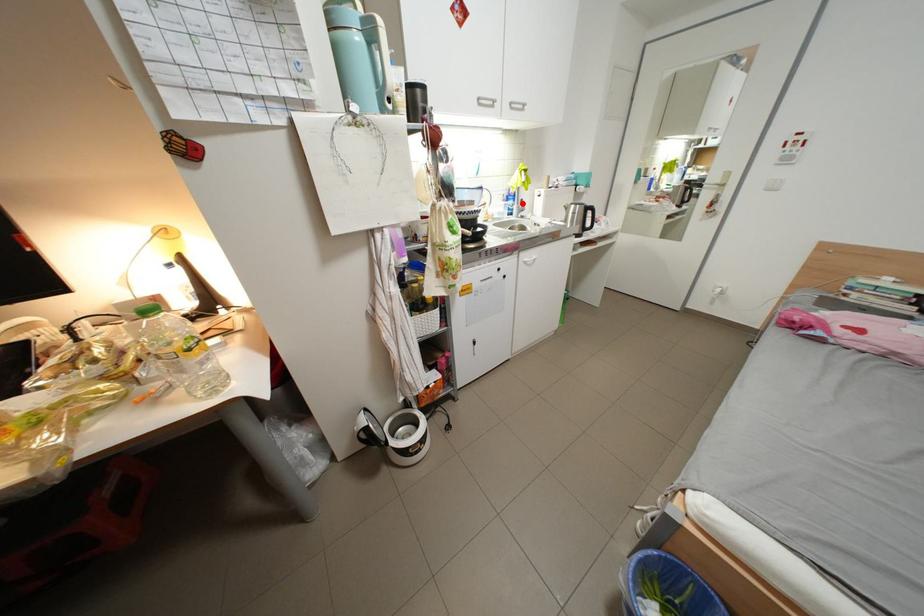
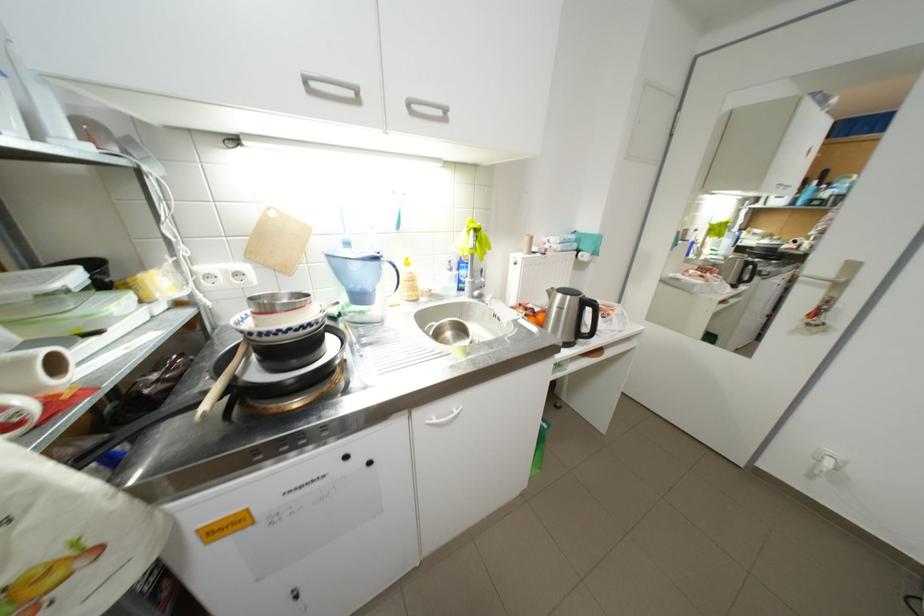
Question: I am providing you with two images of the same scene from different viewpoints. A red point is marked on the first image. Is the red point's position out of view in image 2?

Choices:
 (A) Yes
 (B) No

Answer: (B)